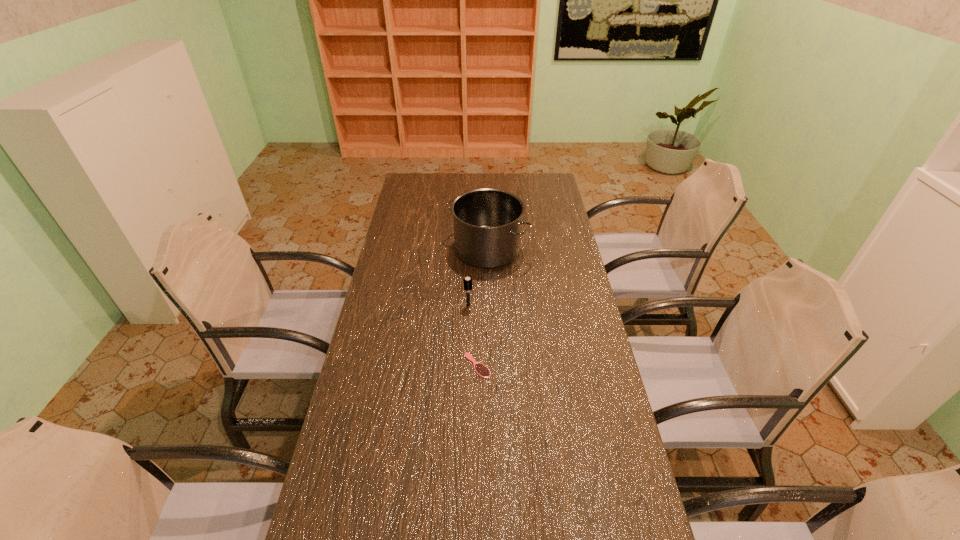
In order to click on saucepan in this screenshot , I will do `click(487, 222)`.

Identify the location of the tallest object. (487, 222).

What are the coordinates of `the taller hairbrush` in the screenshot? It's located at pyautogui.click(x=467, y=281).

Where is `the farther hairbrush`? Image resolution: width=960 pixels, height=540 pixels. the farther hairbrush is located at coordinates (467, 281).

The height and width of the screenshot is (540, 960). Find the location of `the shortest object`. the shortest object is located at coordinates (482, 370).

Locate an element on the screen. Image resolution: width=960 pixels, height=540 pixels. the shorter hairbrush is located at coordinates (482, 370).

Locate an element on the screen. vacant region located on the right of the farthest object is located at coordinates (542, 249).

This screenshot has width=960, height=540. In order to click on free location located on the front of the second nearest object in this screenshot , I will do `click(467, 355)`.

Where is `vacant point located on the right of the nearer hairbrush`? Image resolution: width=960 pixels, height=540 pixels. vacant point located on the right of the nearer hairbrush is located at coordinates (555, 366).

At what (x,y) coordinates should I click in order to perform the action: click on vacant space at the far edge of the desktop. Please return your answer as a coordinate pair (x, y). The height and width of the screenshot is (540, 960). Looking at the image, I should click on (481, 177).